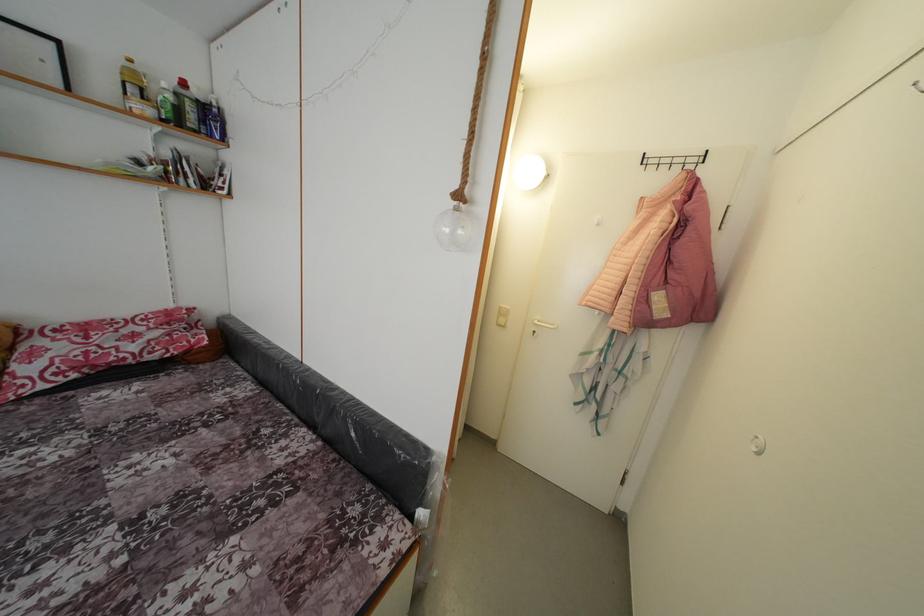
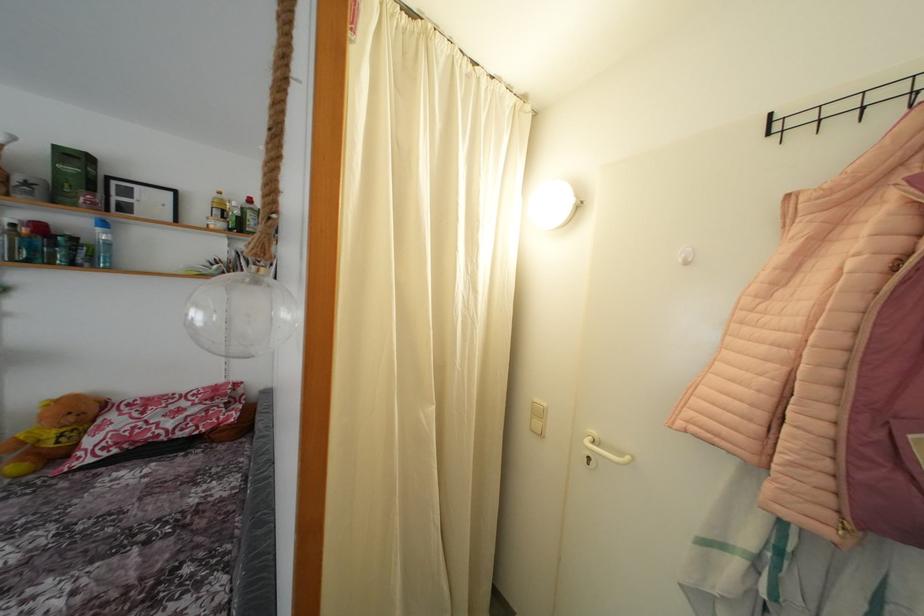
Find the pixel in the second image that matches point (235, 200) in the first image.

(281, 286)